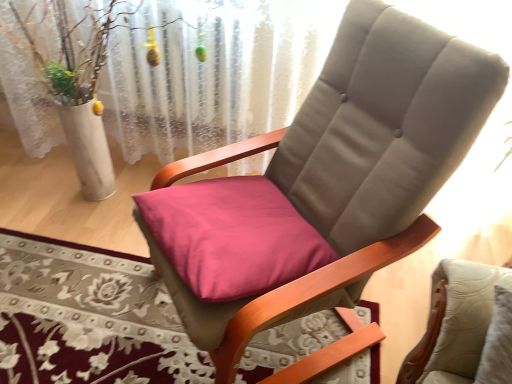
In order to click on free region on the left part of suede-like beige chair at center in this screenshot , I will do `click(90, 305)`.